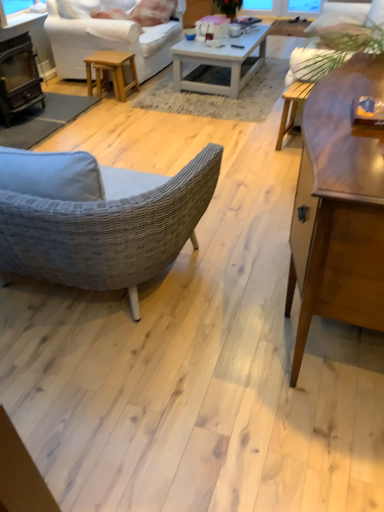
This screenshot has width=384, height=512. What do you see at coordinates (153, 12) in the screenshot?
I see `white cotton pillow at upper center` at bounding box center [153, 12].

Locate an element on the screen. The width and height of the screenshot is (384, 512). white fabric studio couch at upper left is located at coordinates (107, 39).

Find the location of a particular element. This screenshot has width=384, height=512. white fabric couch at upper center is located at coordinates (337, 39).

This screenshot has width=384, height=512. I want to click on white glossy coffee table at center, which is counted as the first coffee table, starting from the top, so click(x=220, y=61).

Who is shorter, white fabric studio couch at upper left or white cotton pillow at upper center?

white cotton pillow at upper center.

Between point (111, 20) and point (131, 13), which one is positioned behind?

The point (131, 13) is farther from the camera.

Between white fabric studio couch at upper left and white cotton pillow at upper center, which one has larger width?

white fabric studio couch at upper left is wider.

From the image's perspective, which object appears higher, white fabric studio couch at upper left or white cotton pillow at upper center?

A: From the image's view, white cotton pillow at upper center is above.

Can you tell me how much white cotton pillow at upper center and black cast iron fireplace at left differ in facing direction?

87.8 degrees.

From the image's perspective, between white cotton pillow at upper center and black cast iron fireplace at left, who is located below?

From the image's view, black cast iron fireplace at left is below.

Which of these two, white cotton pillow at upper center or black cast iron fireplace at left, is bigger?

black cast iron fireplace at left is bigger.

Is white cotton pillow at upper center wider than black cast iron fireplace at left?

No, white cotton pillow at upper center is not wider than black cast iron fireplace at left.

Looking at their sizes, would you say light brown wooden stool at center is wider or thinner than white glossy coffee table at center, the second coffee table positioned from the bottom?

light brown wooden stool at center is thinner than white glossy coffee table at center, the second coffee table positioned from the bottom.

How distant is light brown wooden stool at center from white glossy coffee table at center, which is counted as the first coffee table, starting from the top?

A distance of 29.96 inches exists between light brown wooden stool at center and white glossy coffee table at center, which is counted as the first coffee table, starting from the top.

From a real-world perspective, is light brown wooden stool at center physically located above or below white glossy coffee table at center, the second coffee table positioned from the bottom?

Clearly, from a real-world perspective, light brown wooden stool at center is below white glossy coffee table at center, the second coffee table positioned from the bottom.

In the scene shown: Are light brown wooden stool at center and white glossy coffee table at center, which is counted as the first coffee table, starting from the top, making contact?

No, light brown wooden stool at center is not next to white glossy coffee table at center, which is counted as the first coffee table, starting from the top.

Between point (172, 7) and point (232, 68), which one is positioned behind?

Positioned behind is point (172, 7).

Locate an element on the screen. coffee table that is the 1st one when counting downward from the white cotton pillow at upper center (from the image's perspective) is located at coordinates (220, 61).

Does white cotton pillow at upper center contain white glossy coffee table at center, which is counted as the first coffee table, starting from the top?

No, white glossy coffee table at center, which is counted as the first coffee table, starting from the top, is located outside of white cotton pillow at upper center.

Considering the sizes of objects white cotton pillow at upper center and white glossy coffee table at center, the second coffee table positioned from the bottom, in the image provided, who is smaller, white cotton pillow at upper center or white glossy coffee table at center, the second coffee table positioned from the bottom,?

With smaller size is white cotton pillow at upper center.

From a real-world perspective, which is physically below, wooden coffee table at center, the 2th coffee table in the top-to-bottom sequence, or white fabric studio couch at upper left?

white fabric studio couch at upper left.

Can white fabric studio couch at upper left be found inside wooden coffee table at center, which appears as the 1th coffee table when ordered from the bottom?

Definitely not — white fabric studio couch at upper left is not inside wooden coffee table at center, which appears as the 1th coffee table when ordered from the bottom.

Where is `studio couch above the wooden coffee table at center, the first coffee table positioned from the front (from the image's perspective)`? studio couch above the wooden coffee table at center, the first coffee table positioned from the front (from the image's perspective) is located at coordinates (107, 39).

Consider the image. Considering the relative sizes of wooden coffee table at center, the 2th coffee table in the top-to-bottom sequence, and white fabric studio couch at upper left in the image provided, is wooden coffee table at center, the 2th coffee table in the top-to-bottom sequence, shorter than white fabric studio couch at upper left?

Incorrect, the height of wooden coffee table at center, the 2th coffee table in the top-to-bottom sequence, does not fall short of that of white fabric studio couch at upper left.

From the image's perspective, is white fabric studio couch at upper left positioned above or below wooden coffee table at center, which appears as the 1th coffee table when ordered from the bottom?

Clearly, from the image's perspective, white fabric studio couch at upper left is above wooden coffee table at center, which appears as the 1th coffee table when ordered from the bottom.

Do you think white fabric studio couch at upper left is within wooden coffee table at center, the 2th coffee table in the top-to-bottom sequence, or outside of it?

white fabric studio couch at upper left lies outside wooden coffee table at center, the 2th coffee table in the top-to-bottom sequence.

Who is shorter, white fabric studio couch at upper left or wooden coffee table at center, which appears as the 1th coffee table when ordered from the bottom?

With less height is white fabric studio couch at upper left.

Is white fabric studio couch at upper left oriented away from wooden coffee table at center, which appears as the 1th coffee table when ordered from the bottom?

white fabric studio couch at upper left is not turned away from wooden coffee table at center, which appears as the 1th coffee table when ordered from the bottom.

Is black cast iron fireplace at left taller than light brown wooden stool at center?

Yes.

Based on their positions, is black cast iron fireplace at left located to the left or right of light brown wooden stool at center?

Based on their positions, black cast iron fireplace at left is located to the left of light brown wooden stool at center.

Is black cast iron fireplace at left aimed at light brown wooden stool at center?

No.

Find the location of a particular element. The width and height of the screenshot is (384, 512). studio couch located underneath the white cotton pillow at upper center (from a real-world perspective) is located at coordinates (107, 39).

Where is `fireplace located below the white cotton pillow at upper center (from the image's perspective)`? fireplace located below the white cotton pillow at upper center (from the image's perspective) is located at coordinates (18, 77).

When comparing their distances from white cotton pillow at upper center, does white fabric couch at upper center or white glossy coffee table at center, which is counted as the 1th coffee table, starting from the back, seem closer?

white glossy coffee table at center, which is counted as the 1th coffee table, starting from the back, is closer to white cotton pillow at upper center.

From the image, which object appears to be nearer to white cotton pillow at upper center, white glossy coffee table at center, which is counted as the first coffee table, starting from the top, or white fabric couch at upper center?

white glossy coffee table at center, which is counted as the first coffee table, starting from the top, is positioned closer to the anchor white cotton pillow at upper center.

Based on their spatial positions, is light brown wooden stool at center or wooden coffee table at center, which appears as the 2th coffee table when viewed from the back, closer to white glossy coffee table at center, the second coffee table positioned from the bottom?

Among the two, light brown wooden stool at center is located nearer to white glossy coffee table at center, the second coffee table positioned from the bottom.

Estimate the real-world distances between objects in this image. Which object is further from light brown wooden stool at center, white fabric studio couch at upper left or white cotton pillow at upper center?

The object further to light brown wooden stool at center is white cotton pillow at upper center.

In the scene shown: Considering their positions, is white cotton pillow at upper center positioned further to wooden coffee table at center, which appears as the 2th coffee table when viewed from the back, than white glossy coffee table at center, which is counted as the first coffee table, starting from the top?

white cotton pillow at upper center is positioned further to the anchor wooden coffee table at center, which appears as the 2th coffee table when viewed from the back.

Which object lies nearer to the anchor point wooden coffee table at center, which appears as the 2th coffee table when viewed from the back, white fabric studio couch at upper left or light brown wooden stool at center?

Based on the image, light brown wooden stool at center appears to be nearer to wooden coffee table at center, which appears as the 2th coffee table when viewed from the back.

Considering their positions, is black cast iron fireplace at left positioned closer to light brown wooden stool at center than white fabric studio couch at upper left?

white fabric studio couch at upper left.

Estimate the real-world distances between objects in this image. Which object is further from black cast iron fireplace at left, white fabric couch at upper center or light brown wooden stool at center?

The object further to black cast iron fireplace at left is white fabric couch at upper center.

The height and width of the screenshot is (512, 384). What are the coordinates of `pillow between black cast iron fireplace at left and white glossy coffee table at center, the second coffee table positioned from the bottom` in the screenshot? It's located at (153, 12).

Locate an element on the screen. This screenshot has width=384, height=512. studio couch between black cast iron fireplace at left and light brown wooden stool at center from front to back is located at coordinates (107, 39).

You are a GUI agent. You are given a task and a screenshot of the screen. Output one action in this format:
    pyautogui.click(x=<x>, y=<y>)
    Task: Click on the studio couch between white cotton pillow at upper center and light brown wooden stool at center in the up-down direction
    The height and width of the screenshot is (512, 384).
    Given the screenshot: What is the action you would take?
    [107, 39]

This screenshot has height=512, width=384. I want to click on couch between wooden coffee table at center, which appears as the 1th coffee table when ordered from the bottom, and white cotton pillow at upper center, along the z-axis, so click(x=337, y=39).